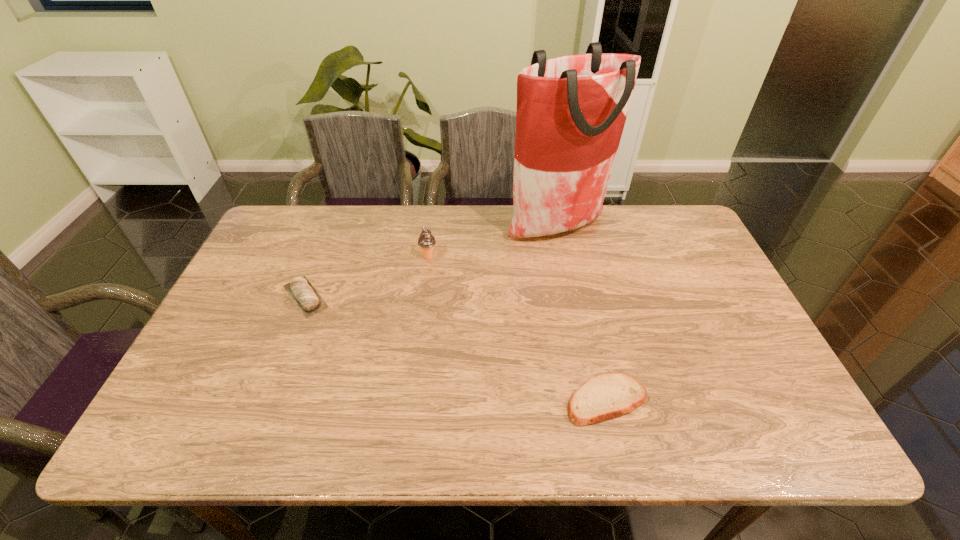
Image resolution: width=960 pixels, height=540 pixels. I want to click on free spot between the shorter pita bread and the tallest object, so click(582, 314).

Identify which object is the nearest to the farther pita bread. Please provide its 2D coordinates. Your answer should be formatted as a tuple, i.e. [(x, y)], where the tuple contains the x and y coordinates of a point satisfying the conditions above.

[(426, 241)]

Identify which object is the second nearest to the shorter pita bread. Please provide its 2D coordinates. Your answer should be formatted as a tuple, i.e. [(x, y)], where the tuple contains the x and y coordinates of a point satisfying the conditions above.

[(426, 241)]

Where is `free space that satisfies the following two spatial constraints: 1. on the front side of the shorter pita bread; 2. on the right side of the icecream`? free space that satisfies the following two spatial constraints: 1. on the front side of the shorter pita bread; 2. on the right side of the icecream is located at coordinates (410, 400).

What are the coordinates of `free space that satisfies the following two spatial constraints: 1. on the back side of the icecream; 2. on the left side of the grocery bag` in the screenshot? It's located at (432, 227).